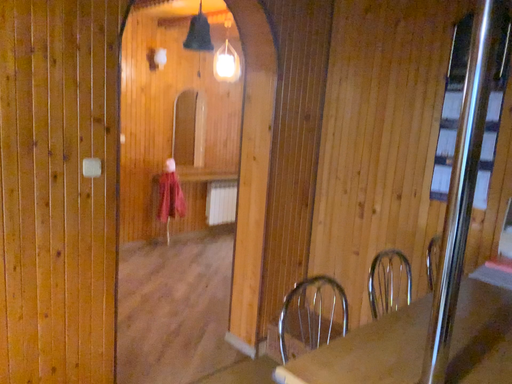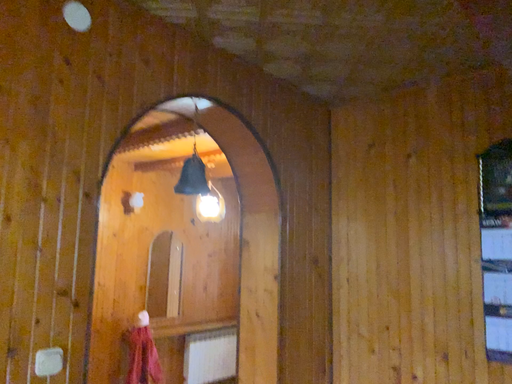
Question: Which way did the camera rotate in the video?

Choices:
 (A) rotated upward
 (B) rotated downward

Answer: (A)